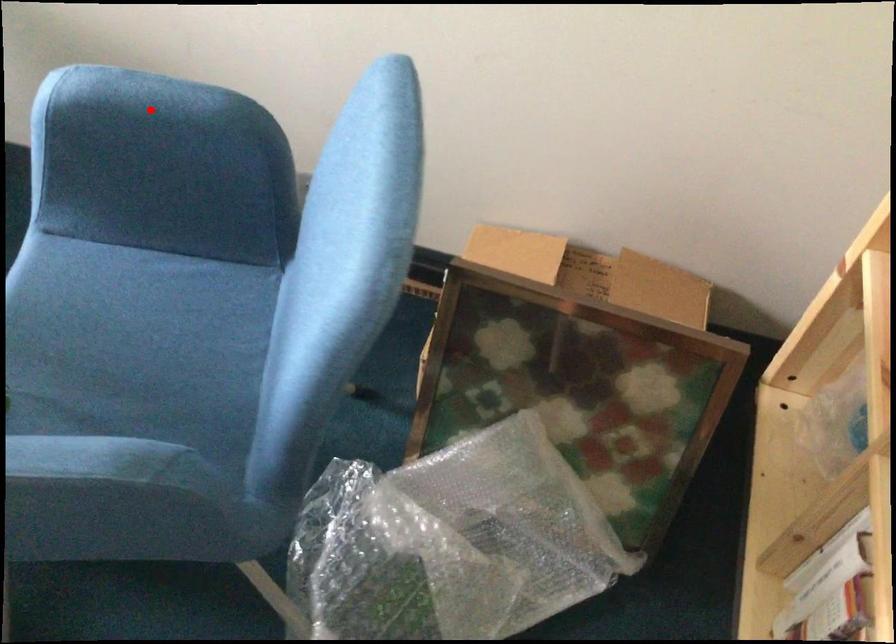
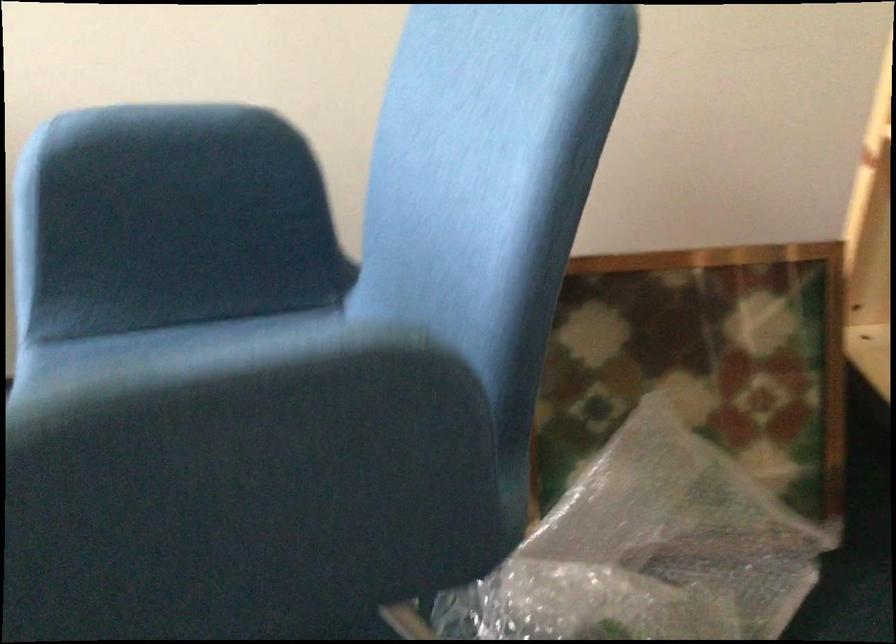
Where in the second image is the point corresponding to the highlighted location from the first image?

(159, 142)